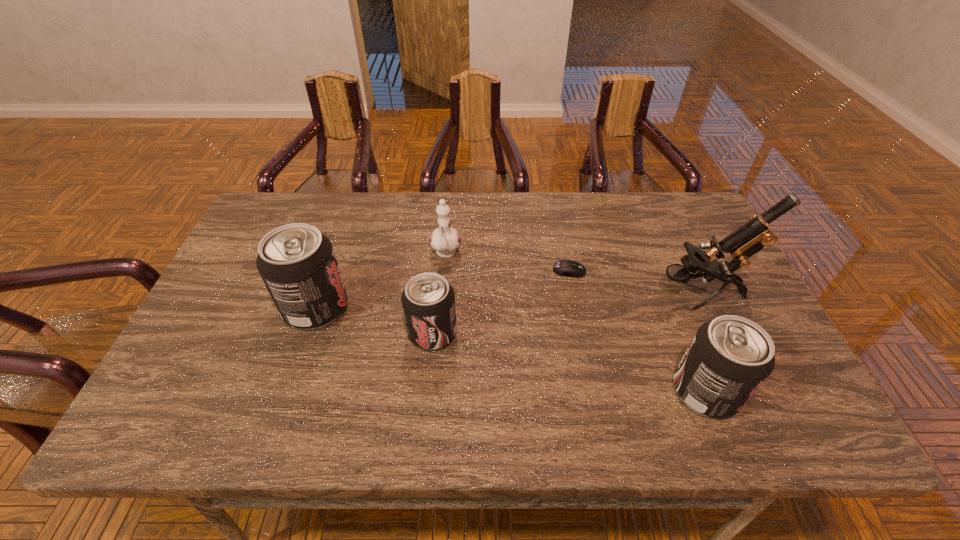
I want to click on vacant position in the image that satisfies the following two spatial constraints: 1. on the front side of the leftmost soda can; 2. on the left side of the second shortest soda can, so click(288, 391).

This screenshot has width=960, height=540. What are the coordinates of `free spot that satisfies the following two spatial constraints: 1. on the front side of the leftmost soda can; 2. on the right side of the second soda can from left to right` in the screenshot? It's located at tap(308, 333).

Locate an element on the screen. The height and width of the screenshot is (540, 960). free space that satisfies the following two spatial constraints: 1. on the front side of the second soda can from right to left; 2. on the left side of the nearest object is located at coordinates (427, 391).

Find the location of `vacant point that satisfies the following two spatial constraints: 1. at the spout of the nearest object; 2. on the right side of the chinaware`. vacant point that satisfies the following two spatial constraints: 1. at the spout of the nearest object; 2. on the right side of the chinaware is located at coordinates (435, 391).